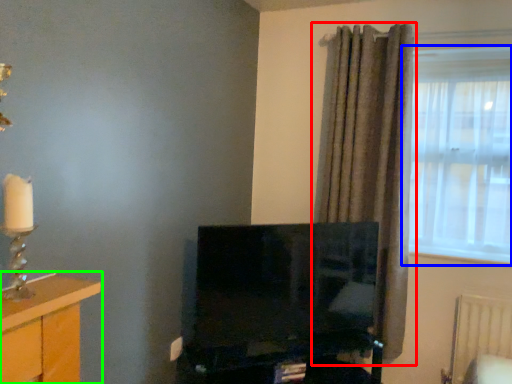
Question: Considering the real-world distances, which object is farthest from curtain (highlighted by a red box)? window (highlighted by a blue box) or furniture (highlighted by a green box)?

Choices:
 (A) window
 (B) furniture

Answer: (B)